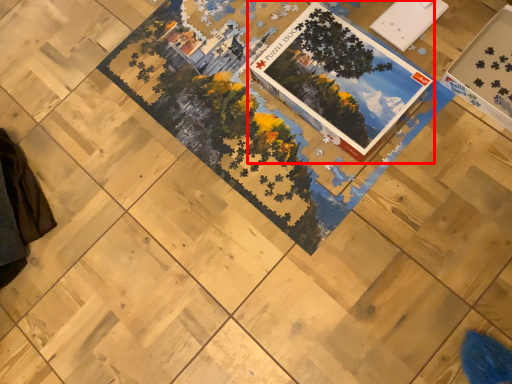
Question: Where is book (annotated by the red box) located in relation to square in the image?

Choices:
 (A) left
 (B) right

Answer: (A)